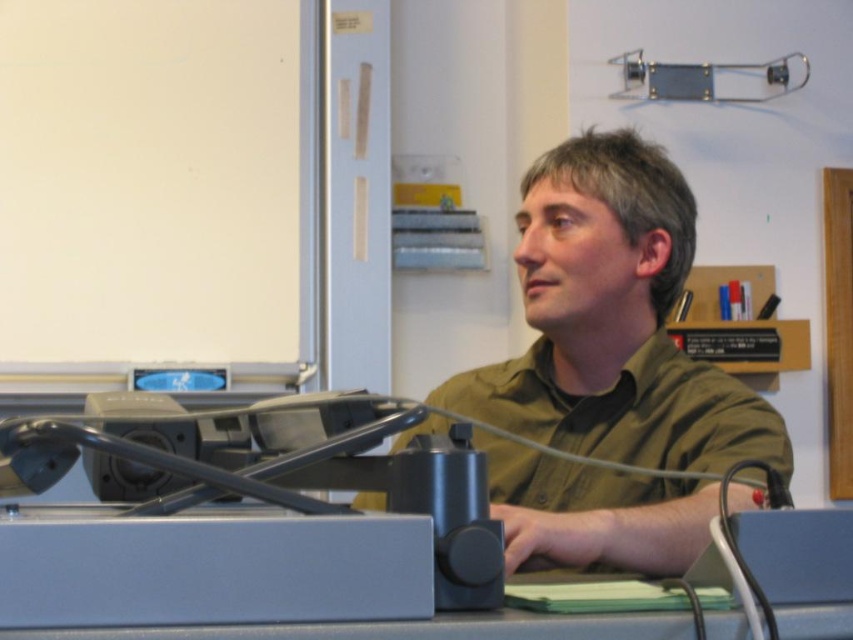
Question: From the image, what is the correct spatial relationship of green matte shirt at center in relation to gray matte table at center?

Choices:
 (A) above
 (B) below

Answer: (A)

Question: Which of the following is the closest to the observer?

Choices:
 (A) (358, 499)
 (B) (663, 634)

Answer: (B)

Question: Which object is closer to the camera taking this photo?

Choices:
 (A) green matte shirt at center
 (B) gray matte table at center

Answer: (B)

Question: Among these points, which one is nearest to the camera?

Choices:
 (A) (509, 625)
 (B) (496, 404)

Answer: (A)

Question: Observing the image, what is the correct spatial positioning of green matte shirt at center in reference to gray matte table at center?

Choices:
 (A) left
 (B) right

Answer: (B)

Question: Does green matte shirt at center appear on the left side of gray matte table at center?

Choices:
 (A) no
 (B) yes

Answer: (A)